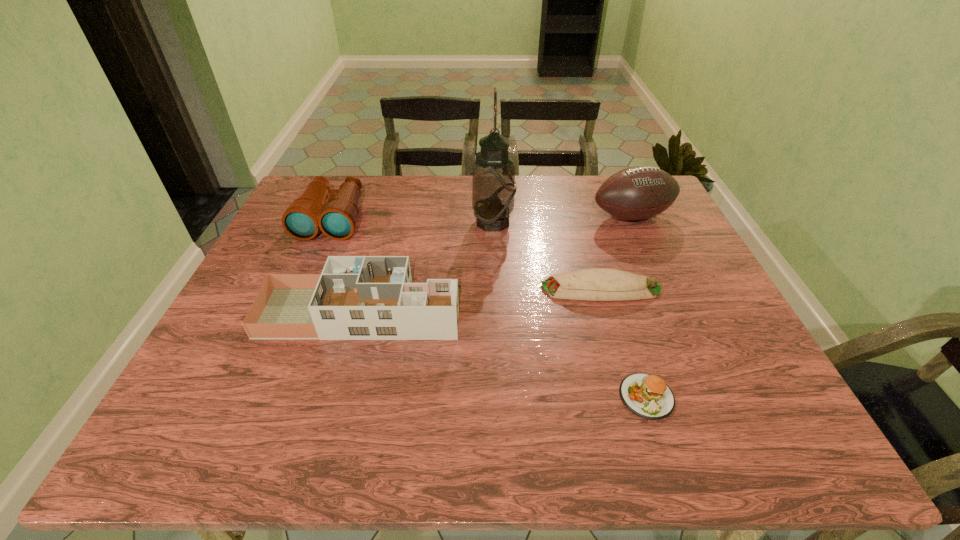
Find the location of a particular element. This screenshot has width=960, height=540. the fourth object from right to left is located at coordinates (493, 182).

Find the location of a particular element. the tallest object is located at coordinates (493, 182).

In order to click on the fifth shortest object in this screenshot , I will do `click(640, 192)`.

The image size is (960, 540). Find the location of `binoculars`. binoculars is located at coordinates (337, 219).

Image resolution: width=960 pixels, height=540 pixels. What are the coordinates of `dollhouse` in the screenshot? It's located at (355, 297).

At what (x,y) coordinates should I click in order to perform the action: click on burrito. Please return your answer as a coordinate pair (x, y). Image resolution: width=960 pixels, height=540 pixels. Looking at the image, I should click on (594, 284).

Locate an element on the screen. The width and height of the screenshot is (960, 540). the nearest object is located at coordinates (648, 396).

At what (x,y) coordinates should I click in order to perform the action: click on vacant position located on the front of the tallest object. Please return your answer as a coordinate pair (x, y). Looking at the image, I should click on (496, 293).

Locate an element on the screen. Image resolution: width=960 pixels, height=540 pixels. vacant space located on the front of the football (American) is located at coordinates click(646, 248).

The image size is (960, 540). Identify the location of vacant position located through the lenses of the binoculars. (308, 274).